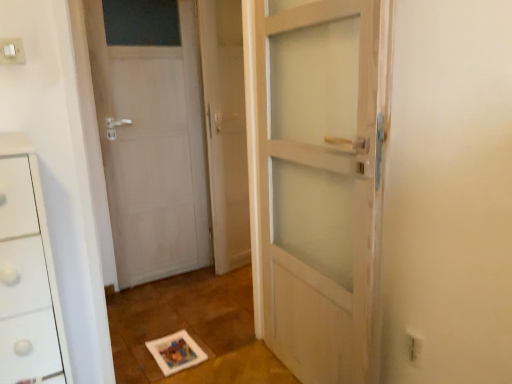
Question: Is clear glass screen door at center positioned beyond the bounds of white plastic electric outlet at upper left, acting as the first electric outlet starting from the top?

Choices:
 (A) no
 (B) yes

Answer: (B)

Question: Is clear glass screen door at center shorter than white plastic electric outlet at upper left, the second electric outlet viewed from the right?

Choices:
 (A) no
 (B) yes

Answer: (A)

Question: Is white plastic electric outlet at upper left, the 1th electric outlet positioned from the left, inside clear glass screen door at center?

Choices:
 (A) yes
 (B) no

Answer: (B)

Question: Is clear glass screen door at center oriented towards white plastic electric outlet at upper left, placed as the second electric outlet when sorted from bottom to top?

Choices:
 (A) yes
 (B) no

Answer: (B)

Question: From a real-world perspective, is clear glass screen door at center positioned over white plastic electric outlet at upper left, the 1th electric outlet positioned from the left, based on gravity?

Choices:
 (A) no
 (B) yes

Answer: (A)

Question: Considering the relative sizes of clear glass screen door at center and white plastic electric outlet at upper left, the 1th electric outlet positioned from the left, in the image provided, is clear glass screen door at center smaller than white plastic electric outlet at upper left, the 1th electric outlet positioned from the left,?

Choices:
 (A) yes
 (B) no

Answer: (B)

Question: Is white plastic electric outlet at lower right, arranged as the second electric outlet when viewed from the left, positioned with its back to white matte door at left?

Choices:
 (A) no
 (B) yes

Answer: (A)

Question: Is white plastic electric outlet at lower right, the 2th electric outlet when ordered from top to bottom, further to camera compared to white matte door at left?

Choices:
 (A) yes
 (B) no

Answer: (B)

Question: Considering the relative sizes of white plastic electric outlet at lower right, which ranks as the first electric outlet in bottom-to-top order, and white matte door at left in the image provided, is white plastic electric outlet at lower right, which ranks as the first electric outlet in bottom-to-top order, shorter than white matte door at left?

Choices:
 (A) yes
 (B) no

Answer: (A)

Question: Is white plastic electric outlet at lower right, arranged as the second electric outlet when viewed from the left, wider than white matte door at left?

Choices:
 (A) no
 (B) yes

Answer: (A)

Question: Would you say white matte door at left is part of white plastic electric outlet at lower right, which is the first electric outlet from right to left,'s contents?

Choices:
 (A) yes
 (B) no

Answer: (B)

Question: Is white plastic electric outlet at lower right, arranged as the second electric outlet when viewed from the left, positioned far away from white matte door at left?

Choices:
 (A) yes
 (B) no

Answer: (A)

Question: From the image's perspective, would you say white plastic electric outlet at upper left, the 1th electric outlet positioned from the left, is shown under clear glass screen door at center?

Choices:
 (A) no
 (B) yes

Answer: (A)